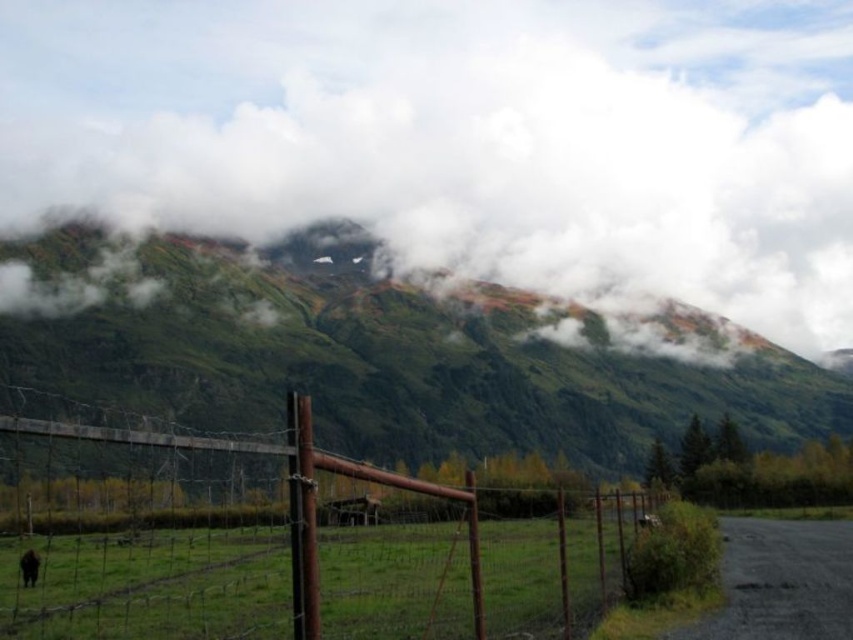
Can you confirm if rusty wire fence at center is positioned above brown furry dog at lower left?

Actually, rusty wire fence at center is below brown furry dog at lower left.

Can you confirm if rusty wire fence at center is positioned to the left of brown furry dog at lower left?

Incorrect, rusty wire fence at center is not on the left side of brown furry dog at lower left.

Does point (534, 566) come behind point (32, 556)?

Yes, it is.

You are a GUI agent. You are given a task and a screenshot of the screen. Output one action in this format:
    pyautogui.click(x=<x>, y=<y>)
    Task: Click on the rusty wire fence at center
    
    Given the screenshot: What is the action you would take?
    pyautogui.click(x=288, y=541)

Describe the element at coordinates (463, 138) in the screenshot. I see `cloudy sky at upper center` at that location.

The height and width of the screenshot is (640, 853). What are the coordinates of `cloudy sky at upper center` in the screenshot? It's located at (463, 138).

Who is more forward, (280, 330) or (320, 611)?

Point (320, 611) is in front.

Find the location of a particular element. The width and height of the screenshot is (853, 640). green grassy hill at center is located at coordinates (399, 362).

Which is in front, point (233, 282) or point (9, 433)?

Point (9, 433)

This screenshot has width=853, height=640. I want to click on green grassy hill at center, so click(399, 362).